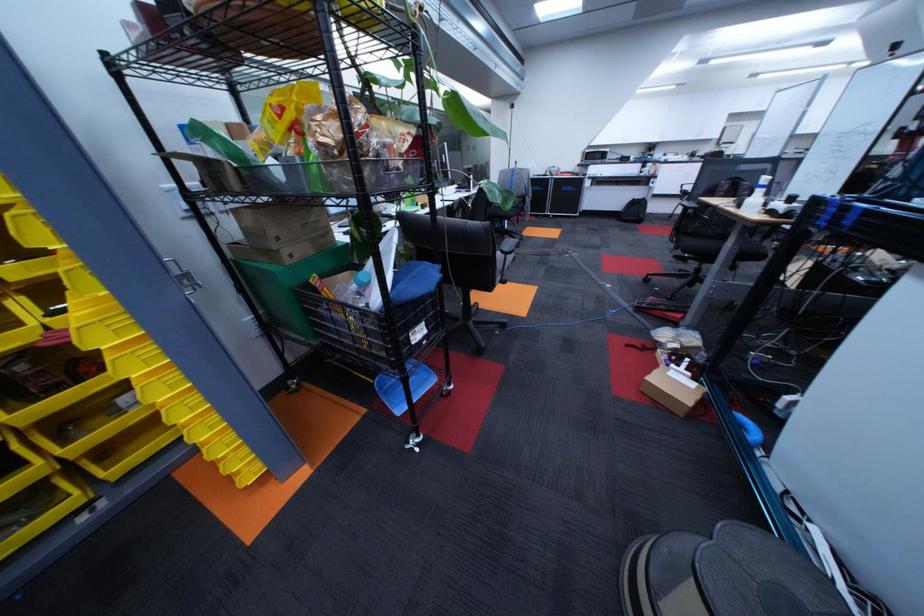
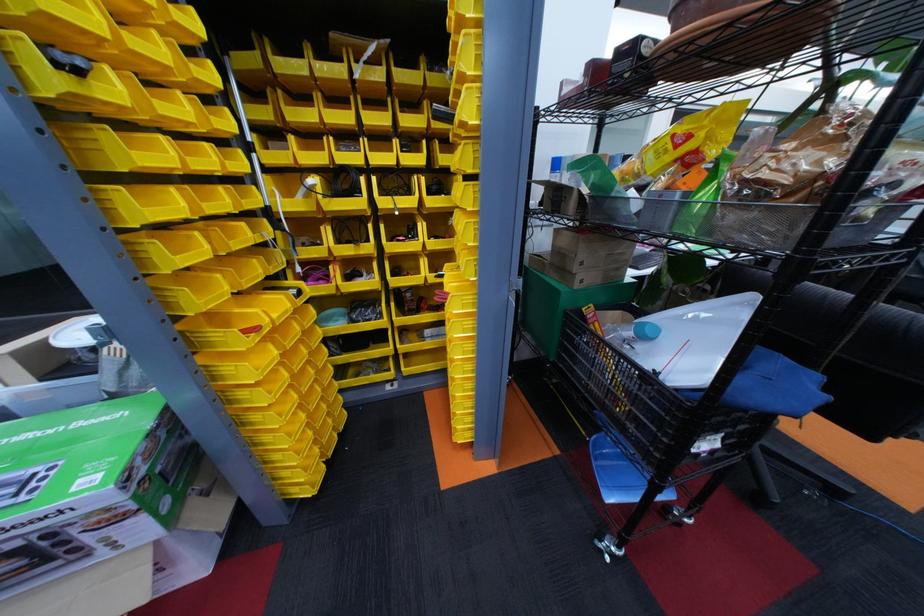
In the second image, find the point that corresponds to (332,119) in the first image.

(801, 148)